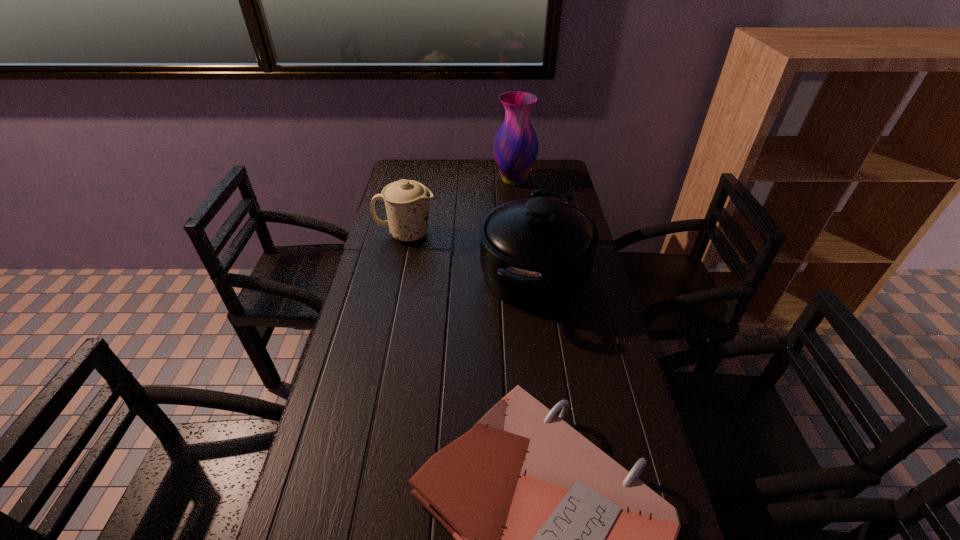
Locate an element on the screen. vase is located at coordinates (515, 147).

Find the location of a particular element. This screenshot has height=540, width=960. the tallest object is located at coordinates (515, 147).

Find the location of `the third shortest object`. the third shortest object is located at coordinates (536, 254).

Where is `the second shortest object`? the second shortest object is located at coordinates (407, 201).

Image resolution: width=960 pixels, height=540 pixels. I want to click on chinaware, so click(407, 201).

You are a GUI agent. You are given a task and a screenshot of the screen. Output one action in this format:
    pyautogui.click(x=<x>, y=<y>)
    Task: Click on the free space located on the left of the vase
    Image resolution: width=960 pixels, height=540 pixels.
    Given the screenshot: What is the action you would take?
    pyautogui.click(x=398, y=180)

Where is `free space located 0.290m on the left of the saucepan`? free space located 0.290m on the left of the saucepan is located at coordinates (388, 276).

This screenshot has height=540, width=960. Find the location of `vacant space located on the spout of the leftmost object`. vacant space located on the spout of the leftmost object is located at coordinates (476, 234).

Identify the location of object present at the far edge. (515, 147).

At what (x,y) coordinates should I click in order to perform the action: click on object positioned at the left edge. Please return your answer as a coordinate pair (x, y). The width and height of the screenshot is (960, 540). Looking at the image, I should click on (407, 201).